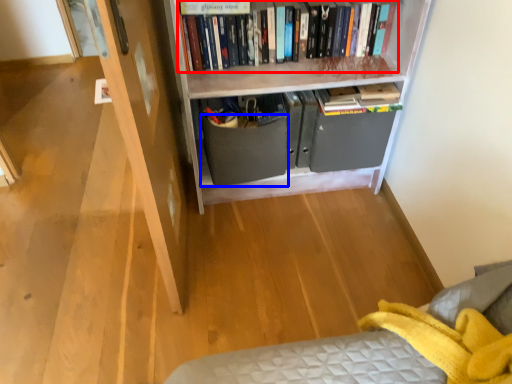
Question: Which point is further to the camera, book (highlighted by a red box) or drawer (highlighted by a blue box)?

Choices:
 (A) book
 (B) drawer

Answer: (B)